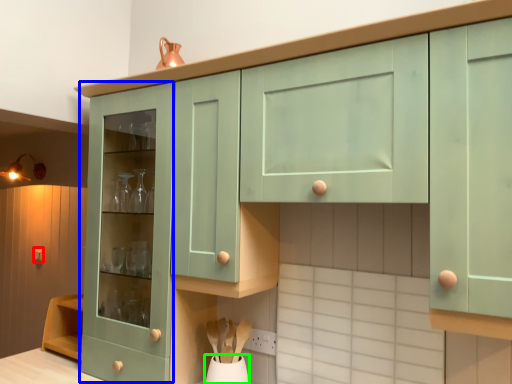
Question: Based on their relative distances, which object is farther from knob (highlighted by a red box)? Choose from cabinetry (highlighted by a blue box) and vase (highlighted by a green box).

Choices:
 (A) cabinetry
 (B) vase

Answer: (B)